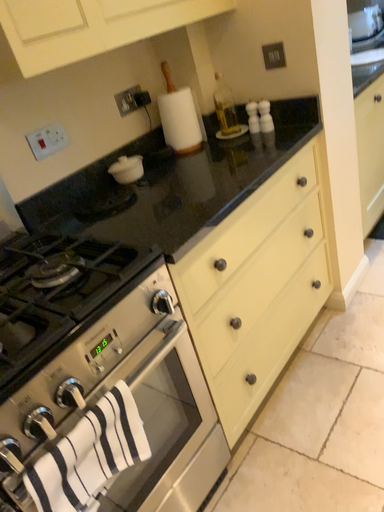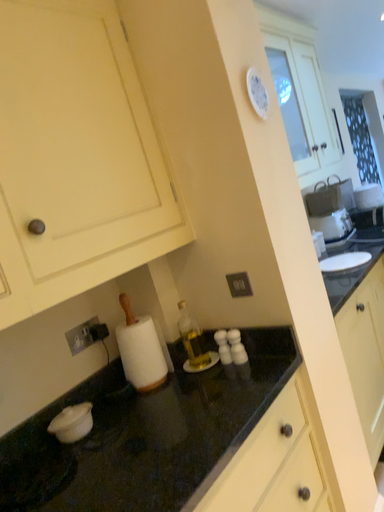
Question: Which way did the camera rotate in the video?

Choices:
 (A) rotated upward
 (B) rotated downward

Answer: (A)